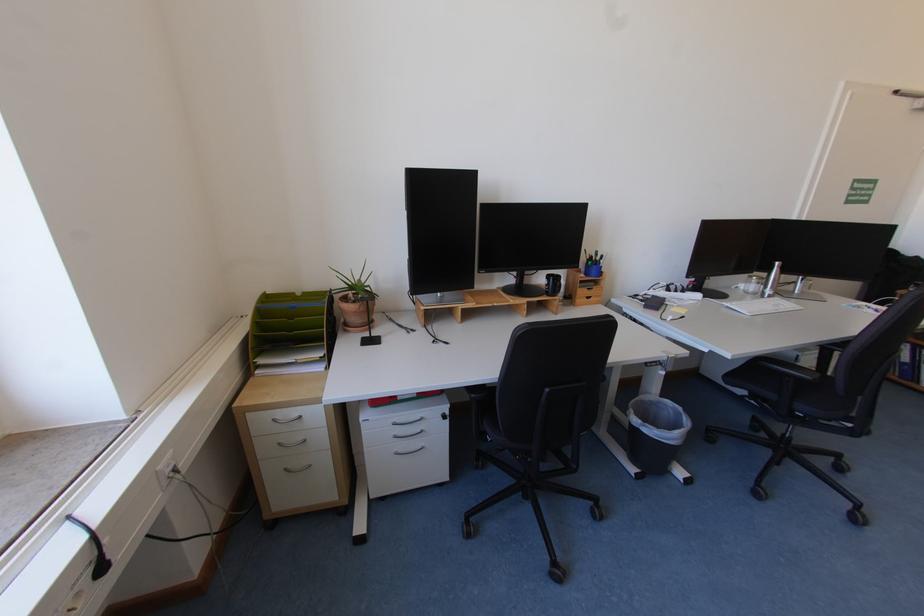
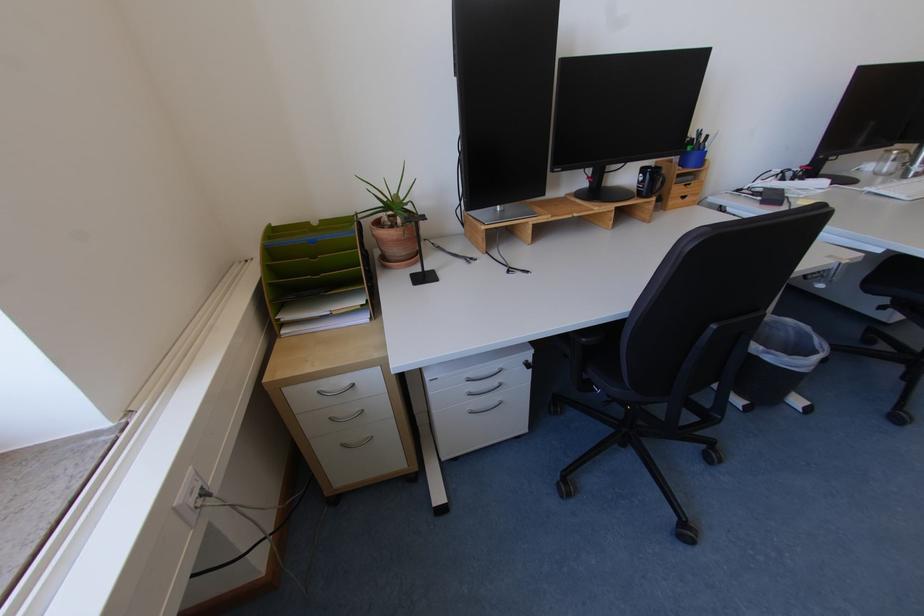
Where in the second image is the point corresponding to the point at 403,451 from the first image?

(477, 410)